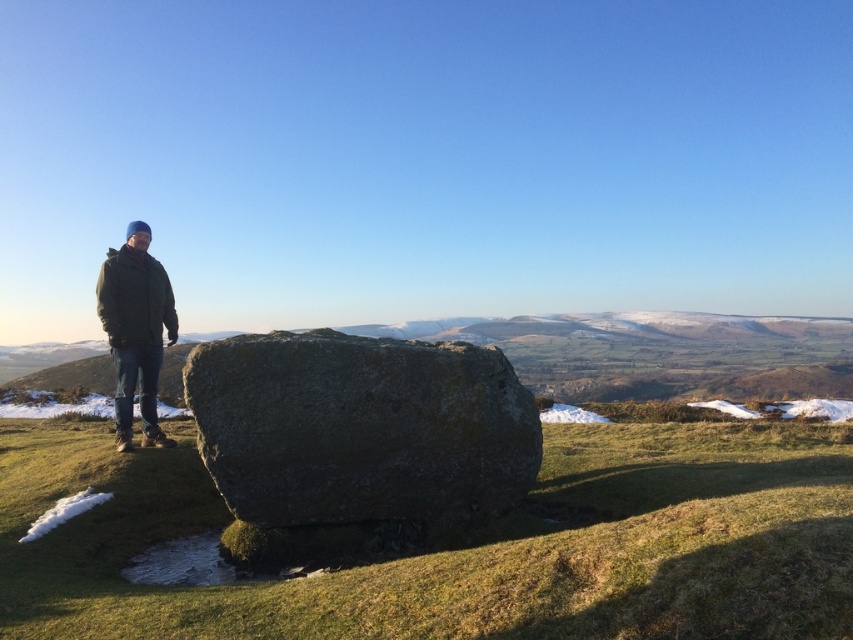
Based on the photo, you are a photographer trying to capture the green mossy rock at center and the green woolen jacket at left in a single frame. Which object is wider so that you can adjust your camera angle accordingly?

The green mossy rock at center is wider than the green woolen jacket at left, so adjust your camera angle to ensure the wider rock is properly framed.

You are a hiker trying to climb the rocks in the scene. You see the green mossy rock at center and the gray rough stone at center. Which rock should you step on first if you want to climb upwards?

You should step on the gray rough stone at center first because the green mossy rock at center is below it, so the gray rough stone is higher up and part of the climbing path.

You are a photographer trying to capture a photo of the green mossy rock at center and the green woolen jacket at left. If your camera has a maximum focus range of 3 meters, will both objects be in focus at the same time?

The green mossy rock at center and green woolen jacket at left are 3.25 meters apart from each other. Since the distance between them exceeds the camera maximum focus range of 3 meters, both objects cannot be in focus simultaneously.